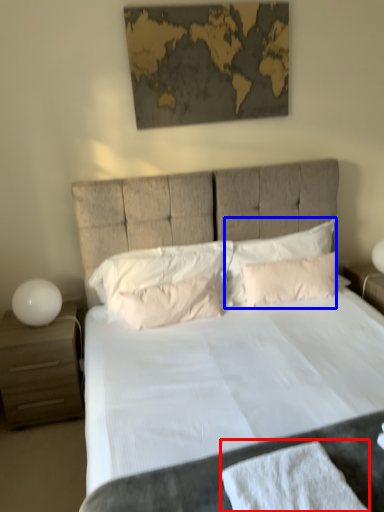
Question: Among these objects, which one is farthest to the camera, bath towel (highlighted by a red box) or pillow (highlighted by a blue box)?

Choices:
 (A) bath towel
 (B) pillow

Answer: (B)